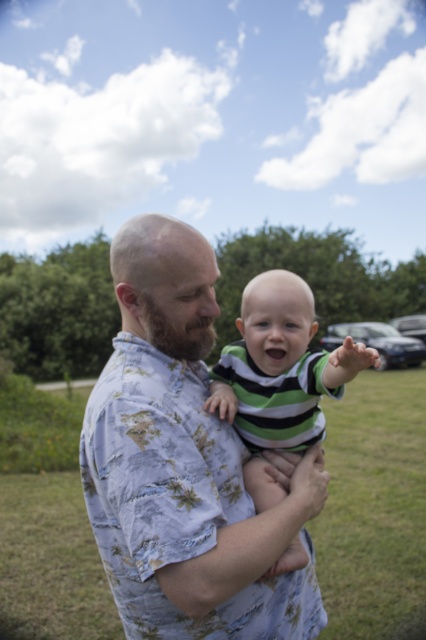
You are a photographer trying to capture both the floral cotton shirt at center and the green striped shirt at center in a single frame. Since the camera has a limited focus range, which shirt should you focus on first to ensure it appears sharp, considering their sizes?

The floral cotton shirt at center is larger in size than the green striped shirt at center, so focusing on the floral cotton shirt at center first would ensure it appears sharp within the camera focus range.

You are a photographer trying to capture the perfect shot of the baby in the green striped shirt at center. To ensure the baby stays in focus, you need to know where the adult in the floral cotton shirt at center is positioned relative to the baby. Is the adult to the left or right of the baby?

The floral cotton shirt at center is to the left of the green striped shirt at center, so the adult in the floral cotton shirt at center is positioned to the left of the baby in the green striped shirt at center.

You are a photographer setting up a photo shoot in a park. You have two shirts to choose from for the adult and baby outfit combination. The options are the floral cotton shirt at center and the green striped shirt at center. Based on the scene description, which shirt should the adult wear to ensure the baby can comfortably reach up to interact with them?

The adult should wear the floral cotton shirt at center because it is much taller than the green striped shirt at center, allowing the baby to comfortably reach up and interact with them.